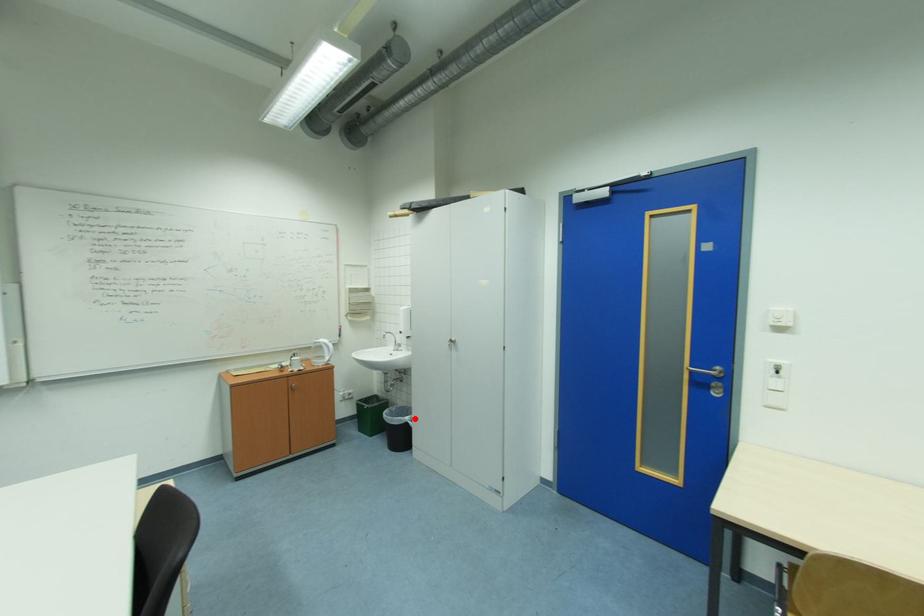
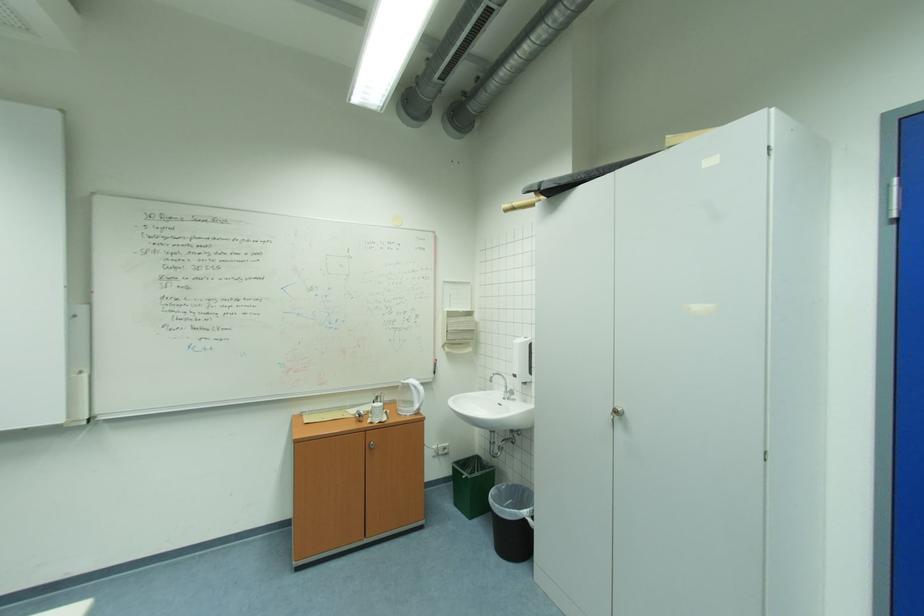
Locate, in the second image, the point that corresponds to the highlighted location in the first image.

(532, 513)